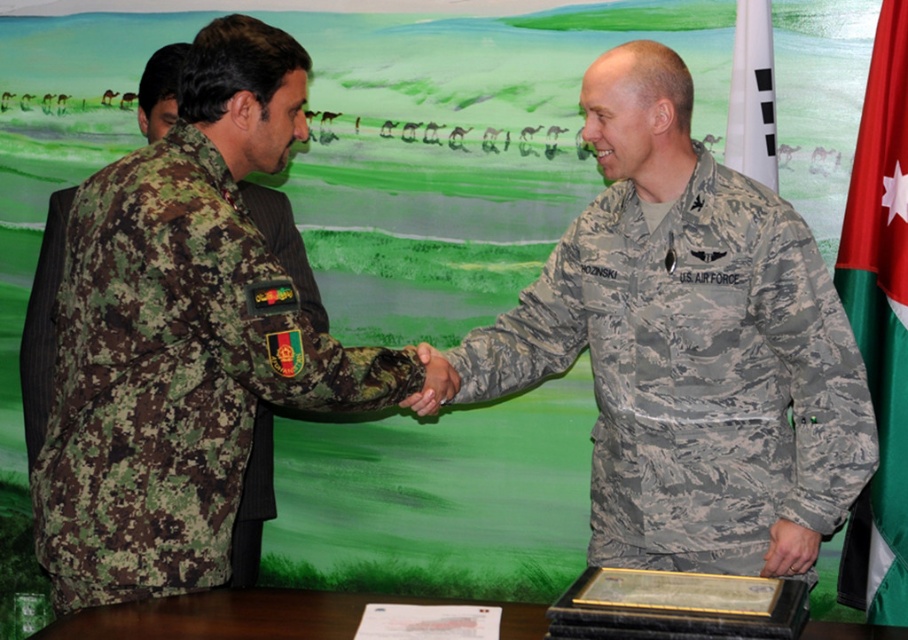
You are a photographer at the event and need to capture a photo of both the camouflage fabric uniform at left and the white fabric flag at upper right in the same frame. Based on their positions, which object is closer to the camera?

The camouflage fabric uniform at left is closer to the camera because it might be wider than the white fabric flag at upper right, indicating it occupies more space in the frame.

You are a photographer who wants to capture the handshake between the two individuals. You notice a point at coordinates (x=173, y=376) in the image. Based on the scene, which object does this point correspond to?

The point at coordinates (x=173, y=376) corresponds to the camouflage fabric uniform at left.